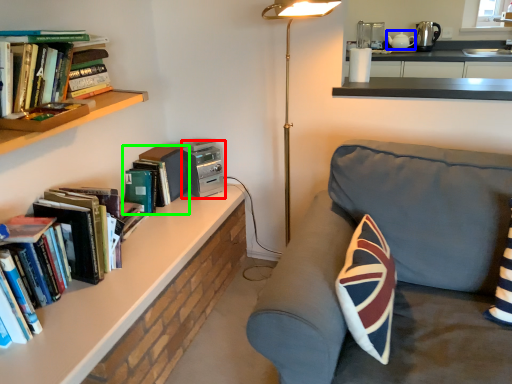
Question: Which is nearer to the appliance (highlighted by a red box)? appliance (highlighted by a blue box) or book (highlighted by a green box).

Choices:
 (A) appliance
 (B) book

Answer: (B)